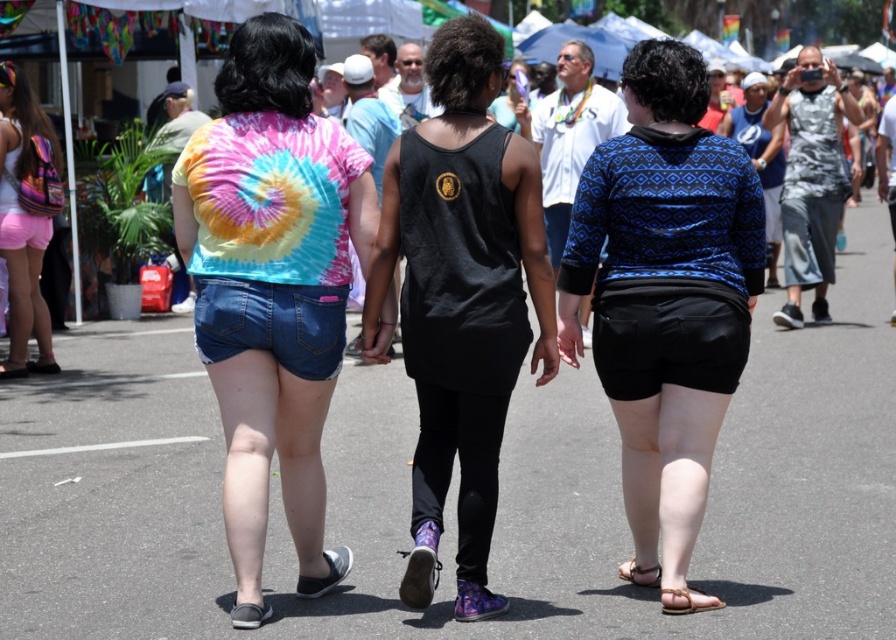
Question: Which object appears closest to the camera in this image?

Choices:
 (A) tie-dye fabric shirt at center
 (B) brown leather sandal at lower right
 (C) blue printed sweater at center
 (D) gray fabric sandal at lower left

Answer: (D)

Question: Does tie-dye fabric shirt at center appear over brown leather sandal at lower right?

Choices:
 (A) no
 (B) yes

Answer: (B)

Question: Which point is farther to the camera?

Choices:
 (A) tan leather sandal at lower right
 (B) brown leather sandal at lower right

Answer: (B)

Question: Which object is the closest to the tan leather sandal at lower right?

Choices:
 (A) tie-dye fabric shirt at center
 (B) matte pink shorts at left
 (C) brown leather sandal at lower right
 (D) blue printed sweater at center

Answer: (C)

Question: Is blue printed sweater at center further to camera compared to brown leather sandal at lower right?

Choices:
 (A) no
 (B) yes

Answer: (A)

Question: Is matte pink shorts at left above tan leather sandal at lower right?

Choices:
 (A) no
 (B) yes

Answer: (B)